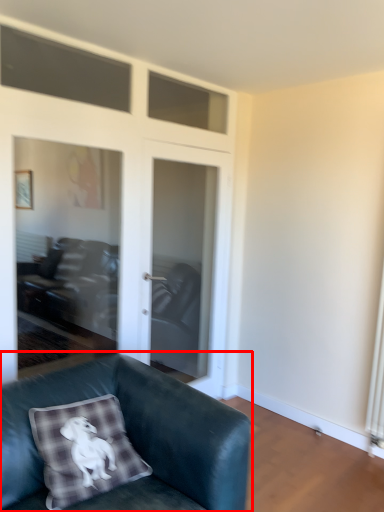
Question: From the image's perspective, considering the relative positions of studio couch (annotated by the red box) and screen door in the image provided, where is studio couch (annotated by the red box) located with respect to the staircase?

Choices:
 (A) above
 (B) below

Answer: (B)